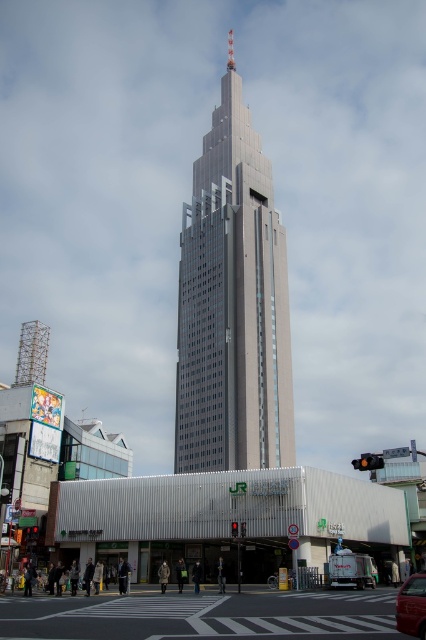
Is sleek gray glass skyscraper at center positioned in front of white asphalt at center?

No.

Which is more to the left, sleek gray glass skyscraper at center or white asphalt at center?

white asphalt at center is more to the left.

The width and height of the screenshot is (426, 640). I want to click on sleek gray glass skyscraper at center, so click(x=233, y=305).

Which is below, sleek gray glass skyscraper at center or red glossy car at lower right?

Positioned lower is red glossy car at lower right.

Can you confirm if sleek gray glass skyscraper at center is smaller than red glossy car at lower right?

Incorrect, sleek gray glass skyscraper at center is not smaller in size than red glossy car at lower right.

Locate an element on the screen. This screenshot has width=426, height=640. sleek gray glass skyscraper at center is located at coordinates (233, 305).

Is white asphalt at center thinner than red glossy car at lower right?

Incorrect, white asphalt at center's width is not less than red glossy car at lower right's.

Does white asphalt at center have a lesser height compared to red glossy car at lower right?

Incorrect, white asphalt at center's height does not fall short of red glossy car at lower right's.

Where is `white asphalt at center`? white asphalt at center is located at coordinates [198, 616].